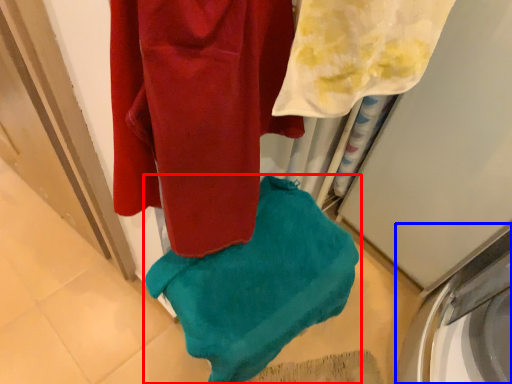
Question: Which point is closer to the camera, towel (highlighted by a red box) or washing machine (highlighted by a blue box)?

Choices:
 (A) towel
 (B) washing machine

Answer: (A)